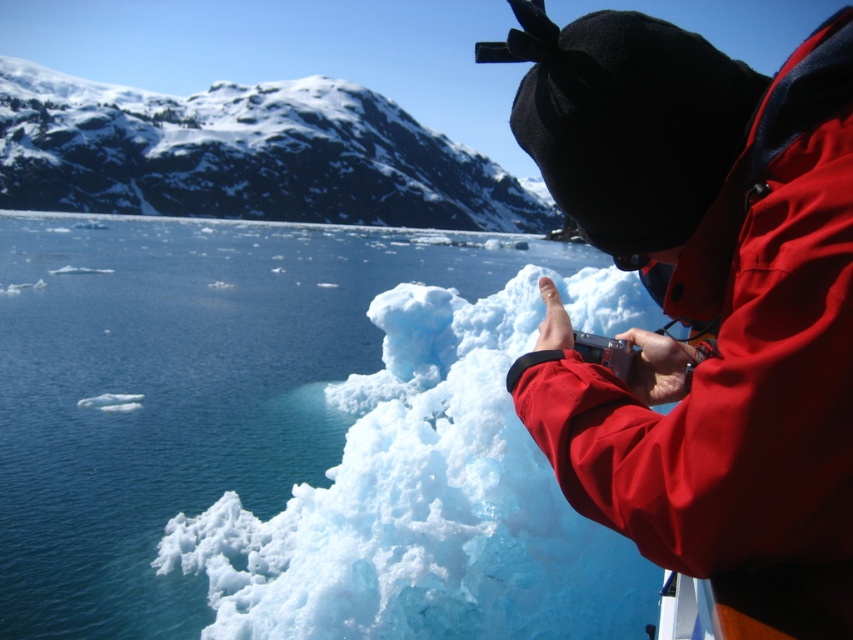
Looking at this image, is transparent blue water at center below matte red jacket at center?

No, transparent blue water at center is not below matte red jacket at center.

Does transparent blue water at center come behind matte red jacket at center?

Yes, it is.

Is point (225, 518) farther from viewer compared to point (598, 372)?

Yes, it is behind point (598, 372).

Where is `transparent blue water at center`? transparent blue water at center is located at coordinates (x=291, y=436).

Between matte red jacket at center and white ice at upper left, which one appears on the left side from the viewer's perspective?

From the viewer's perspective, white ice at upper left appears more on the left side.

Which is behind, point (741, 214) or point (212, 129)?

The point (212, 129) is more distant.

Image resolution: width=853 pixels, height=640 pixels. Find the location of `matte red jacket at center`. matte red jacket at center is located at coordinates (703, 300).

Find the location of a particular element. transparent blue water at center is located at coordinates (291, 436).

Does transparent blue water at center have a lesser width compared to white ice at upper left?

Correct, transparent blue water at center's width is less than white ice at upper left's.

Locate an element on the screen. transparent blue water at center is located at coordinates (291, 436).